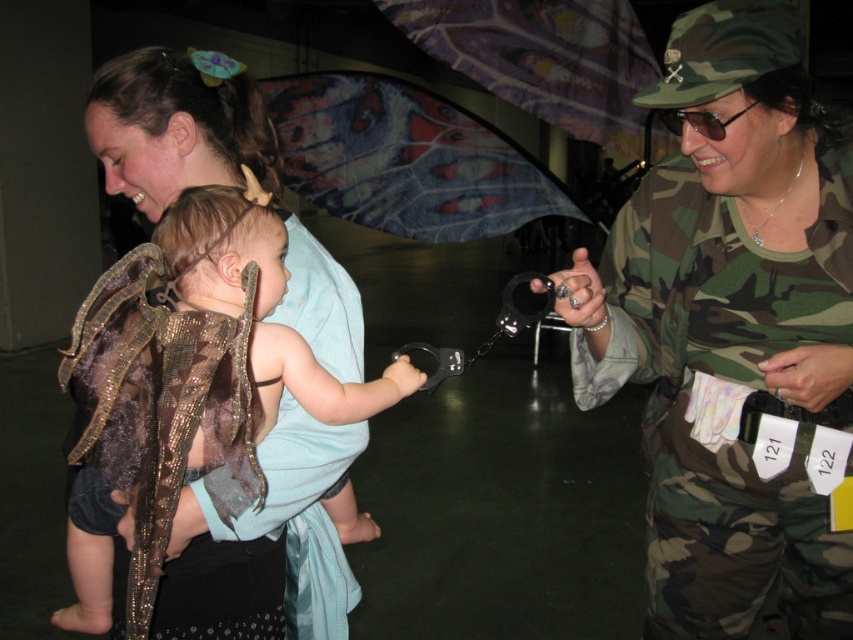
Does camouflage uniform at center appear under camouflage fabric baby carrier at center?

No.

Is camouflage uniform at center thinner than camouflage fabric baby carrier at center?

Incorrect, camouflage uniform at center's width is not less than camouflage fabric baby carrier at center's.

Identify the location of camouflage uniform at center. (732, 330).

Which is more to the right, camouflage uniform at center or matte gold wings at upper left?

camouflage uniform at center

Between camouflage uniform at center and matte gold wings at upper left, which one has more height?

With more height is camouflage uniform at center.

Who is more distant from viewer, (776, 394) or (339, 442)?

The point (776, 394) is more distant.

At what (x,y) coordinates should I click in order to perform the action: click on camouflage uniform at center. Please return your answer as a coordinate pair (x, y). This screenshot has height=640, width=853. Looking at the image, I should click on (732, 330).

In the scene shown: Does matte gold wings at upper left have a greater width compared to camouflage fabric baby carrier at center?

Yes, matte gold wings at upper left is wider than camouflage fabric baby carrier at center.

Does point (141, 115) come behind point (358, 349)?

No, it is not.

Image resolution: width=853 pixels, height=640 pixels. What do you see at coordinates (276, 545) in the screenshot?
I see `matte gold wings at upper left` at bounding box center [276, 545].

The height and width of the screenshot is (640, 853). In order to click on matte gold wings at upper left in this screenshot , I will do `click(276, 545)`.